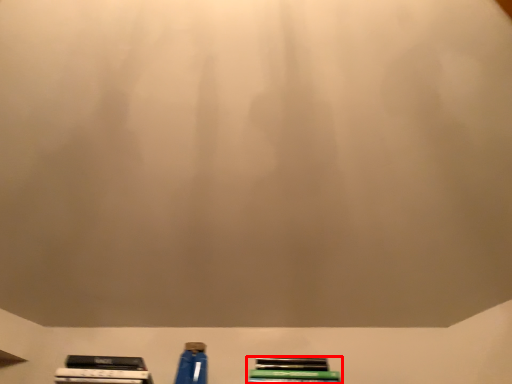
Question: From the image's perspective, considering the relative positions of book (annotated by the red box) and bottle in the image provided, where is book (annotated by the red box) located with respect to the staircase?

Choices:
 (A) below
 (B) above

Answer: (A)